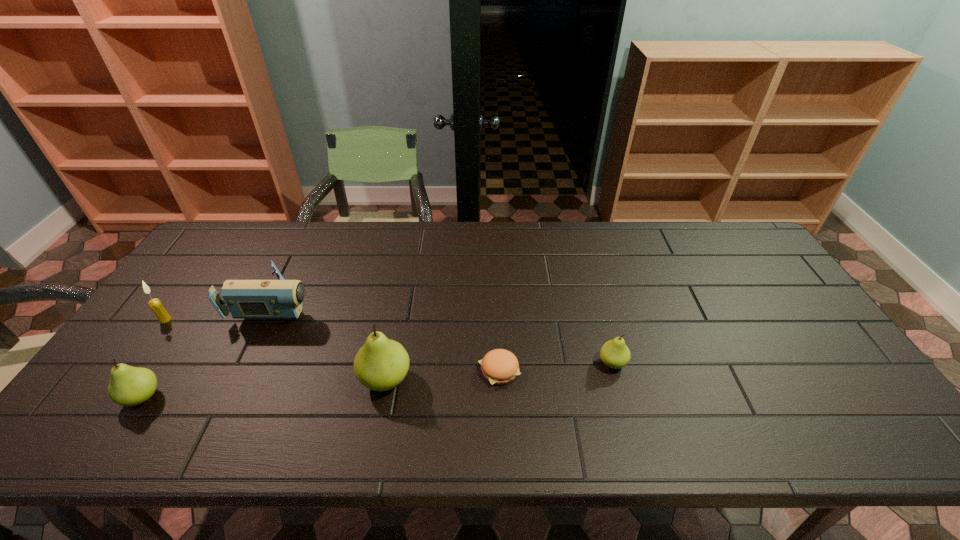
I want to click on object identified as the fifth closest to the leftmost object, so click(x=615, y=354).

I want to click on pear that is the closest to the patty, so click(x=381, y=364).

Identify which pear is located as the second nearest to the leftmost pear. Please provide its 2D coordinates. Your answer should be formatted as a tuple, i.e. [(x, y)], where the tuple contains the x and y coordinates of a point satisfying the conditions above.

[(615, 354)]

Locate an element on the screen. free space in the image that satisfies the following two spatial constraints: 1. on the back side of the rightmost pear; 2. on the side of the camcorder with the flip-out screen is located at coordinates pos(596,302).

Where is `free location that satisfies the following two spatial constraints: 1. on the back side of the rightmost object; 2. on the right side of the tallest pear`? The height and width of the screenshot is (540, 960). free location that satisfies the following two spatial constraints: 1. on the back side of the rightmost object; 2. on the right side of the tallest pear is located at coordinates (389, 363).

Locate an element on the screen. The height and width of the screenshot is (540, 960). vacant area that satisfies the following two spatial constraints: 1. on the side of the camcorder with the flip-out screen; 2. on the front side of the candle is located at coordinates (270, 320).

Identify the location of free point that satisfies the following two spatial constraints: 1. on the side of the camcorder with the flip-out screen; 2. on the right side of the shortest object. This screenshot has height=540, width=960. (246, 370).

Locate an element on the screen. free space that satisfies the following two spatial constraints: 1. on the back side of the tallest object; 2. on the right side of the patty is located at coordinates (387, 370).

Locate an element on the screen. free space that satisfies the following two spatial constraints: 1. on the front side of the leftmost pear; 2. on the left side of the candle is located at coordinates (110, 397).

At what (x,y) coordinates should I click in order to perform the action: click on vacant space that satisfies the following two spatial constraints: 1. on the side of the rightmost object with the flip-out screen; 2. on the right side of the fourth object from right to left. Please return your answer as a coordinate pair (x, y). The height and width of the screenshot is (540, 960). Looking at the image, I should click on (249, 363).